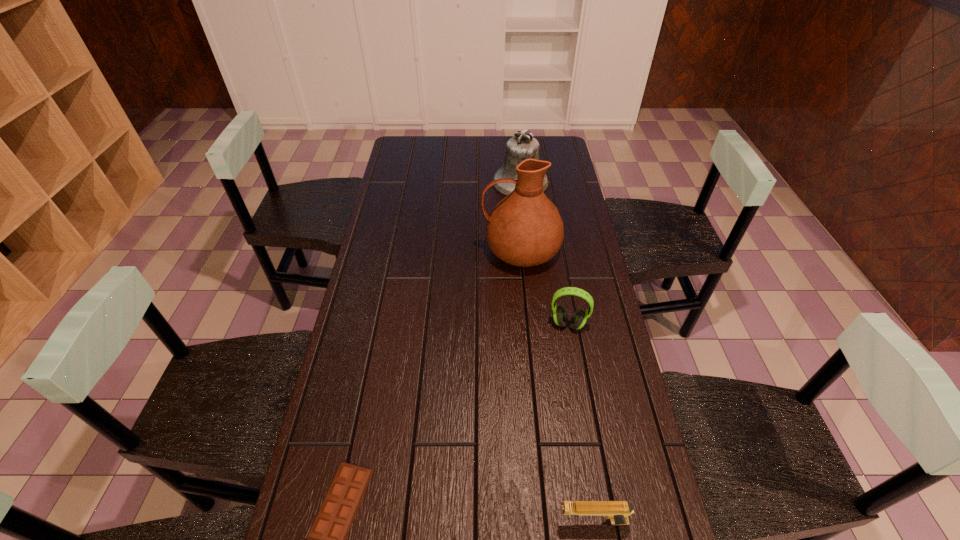
Locate an element on the screen. vacant region located 0.090m on the left of the bell is located at coordinates (470, 182).

This screenshot has width=960, height=540. Identify the location of blank area located 0.270m on the left of the third farthest object. (459, 324).

Locate an element on the screen. vacant space located at the barrel of the pistol is located at coordinates (502, 521).

I want to click on vacant point located 0.210m at the barrel of the pistol, so click(460, 521).

What are the coordinates of `free spot located at the barrel of the pistol` in the screenshot? It's located at (396, 521).

The image size is (960, 540). What are the coordinates of `pitcher located at the right edge` in the screenshot? It's located at (525, 229).

At what (x,y) coordinates should I click in order to perform the action: click on bell present at the right edge. Please return your answer as a coordinate pair (x, y). Looking at the image, I should click on (523, 145).

Find the location of a particular element. headset at the right edge is located at coordinates (578, 319).

You are a GUI agent. You are given a task and a screenshot of the screen. Output one action in this format:
    pyautogui.click(x=<x>, y=<y>)
    Task: Click on the pistol at the right edge
    The width and height of the screenshot is (960, 540).
    Given the screenshot: What is the action you would take?
    pyautogui.click(x=617, y=511)

You are a GUI agent. You are given a task and a screenshot of the screen. Output one action in this format:
    pyautogui.click(x=<x>, y=<y>)
    Task: Click on the free space at the far edge
    Image resolution: width=960 pixels, height=540 pixels.
    Given the screenshot: What is the action you would take?
    pyautogui.click(x=467, y=141)